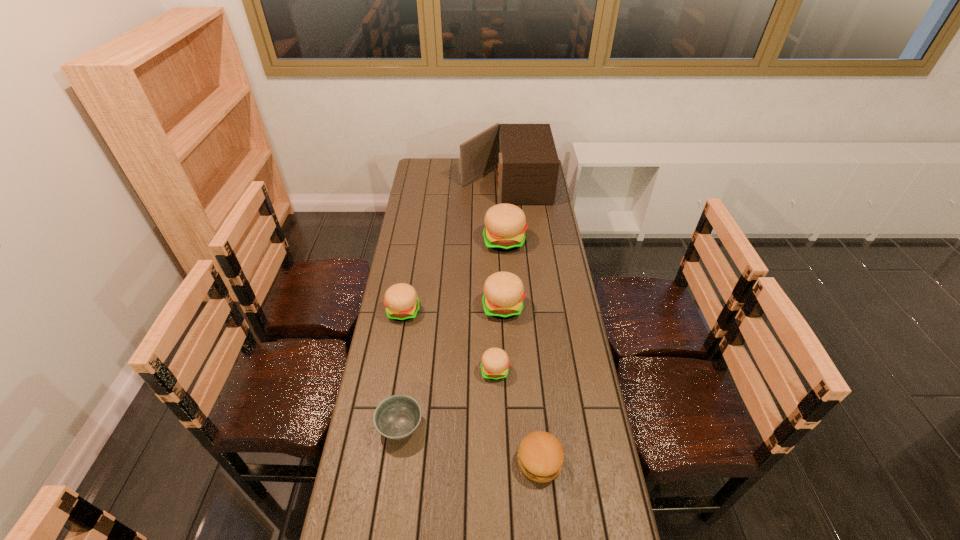
At what (x,y) coordinates should I click in order to perform the action: click on the fourth farthest hamburger. Please return your answer as a coordinate pair (x, y). Image resolution: width=960 pixels, height=540 pixels. Looking at the image, I should click on (495, 362).

Identify the location of the shortest object. (398, 416).

This screenshot has width=960, height=540. In order to click on bowl in this screenshot , I will do `click(398, 416)`.

This screenshot has height=540, width=960. Identify the location of free space located 0.050m with the door open on the front of the microwave oven. (450, 183).

Identify the location of vacant space located 0.110m on the front of the farthest hamburger. The width and height of the screenshot is (960, 540). (506, 272).

The width and height of the screenshot is (960, 540). Identify the location of vacant space located 0.390m on the back of the second tallest hamburger. (499, 232).

The image size is (960, 540). Identify the location of vacant space located 0.230m on the right of the third tallest hamburger. (480, 312).

Where is `blank space located 0.320m on the left of the nearest hamburger`? blank space located 0.320m on the left of the nearest hamburger is located at coordinates (407, 461).

You are a GUI agent. You are given a task and a screenshot of the screen. Output one action in this format:
    pyautogui.click(x=<x>, y=<y>)
    Task: Click on the free space located on the front of the smallest beige hamburger
    The width and height of the screenshot is (960, 540).
    Given the screenshot: What is the action you would take?
    pyautogui.click(x=498, y=477)

Where is `free region located 0.120m on the right of the shortest object`? Image resolution: width=960 pixels, height=540 pixels. free region located 0.120m on the right of the shortest object is located at coordinates (462, 426).